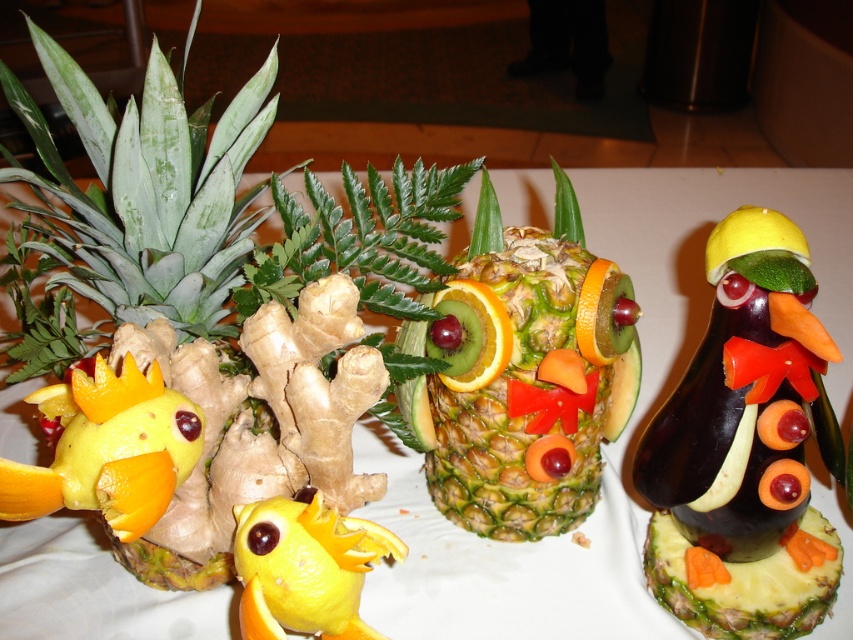
Question: Which point is closer to the camera taking this photo?

Choices:
 (A) (596, 316)
 (B) (306, 600)
 (C) (196, 408)
 (D) (473, 225)

Answer: (B)

Question: Can you confirm if yellow matte pineapple at lower left is positioned to the left of orange peel slice at center?

Choices:
 (A) no
 (B) yes

Answer: (B)

Question: Among these objects, which one is nearest to the camera?

Choices:
 (A) yellow matte pineapple at lower left
 (B) green textured pineapple at center

Answer: (A)

Question: Which point is farther to the camera?

Choices:
 (A) shiny orange slice at center
 (B) green textured pineapple at center
 (C) yellow matte pineapple at lower left

Answer: (B)

Question: Is yellow matte pineapple at lower left thinner than yellow orange peel at center left?

Choices:
 (A) yes
 (B) no

Answer: (B)

Question: Is the position of green textured pineapple at center more distant than that of yellow orange peel at center left?

Choices:
 (A) yes
 (B) no

Answer: (A)